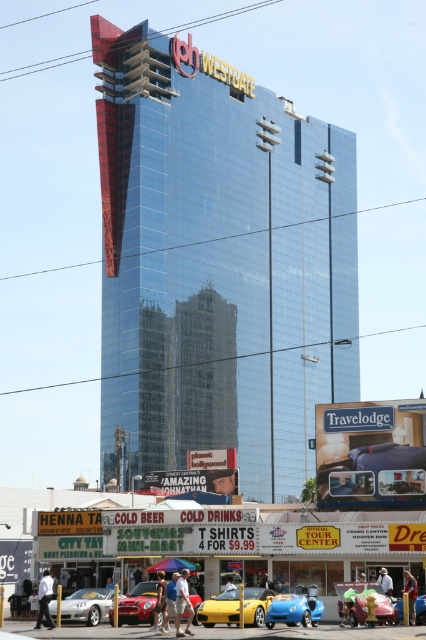
Question: Among these objects, which one is nearest to the camera?

Choices:
 (A) brown straw hat at center
 (B) white cotton shirt at center
 (C) metallic blue car at center

Answer: (C)

Question: Does smooth leather cap at center appear over green fabric pants at lower center?

Choices:
 (A) yes
 (B) no

Answer: (A)

Question: Which object is closer to the camera taking this photo?

Choices:
 (A) denim jacket at center
 (B) blue fabric shorts at lower right
 (C) light brown leather jacket at center

Answer: (A)

Question: Which of the following is the closest to the observer?

Choices:
 (A) silver metallic sports car at center
 (B) brown straw hat at center

Answer: (A)

Question: Is light brown leather jacket at center positioned before light blue jeans at lower center?

Choices:
 (A) no
 (B) yes

Answer: (B)

Question: From the image, what is the correct spatial relationship of shiny glass building at center in relation to smooth leather cap at center?

Choices:
 (A) left
 (B) right

Answer: (A)